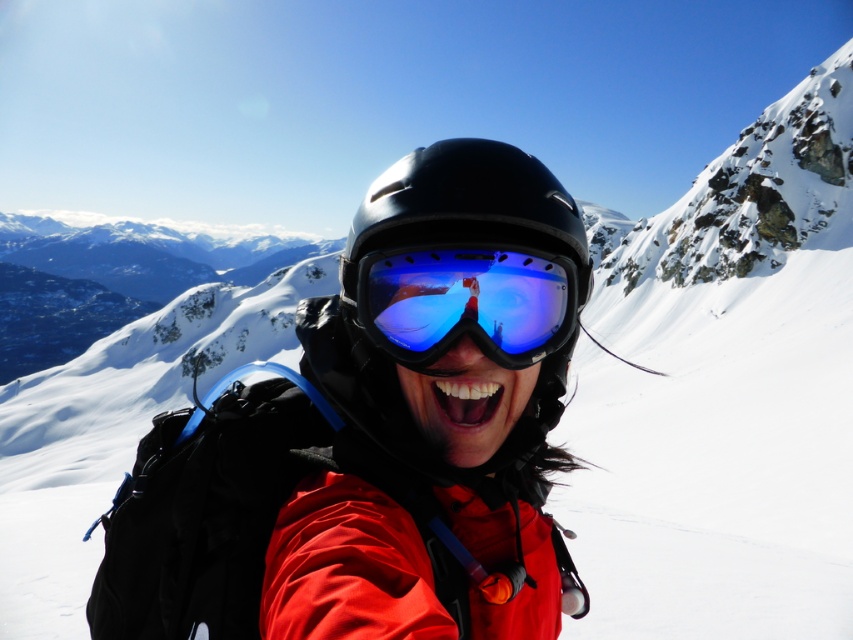
The height and width of the screenshot is (640, 853). What do you see at coordinates (466, 301) in the screenshot?
I see `blue reflective lens at center` at bounding box center [466, 301].

Based on the photo, between blue reflective lens at center and black matte helmet at center, which one has more height?

With more height is black matte helmet at center.

Who is more forward, (476, 276) or (480, 202)?

Point (480, 202) is more forward.

Identify the location of blue reflective lens at center. (466, 301).